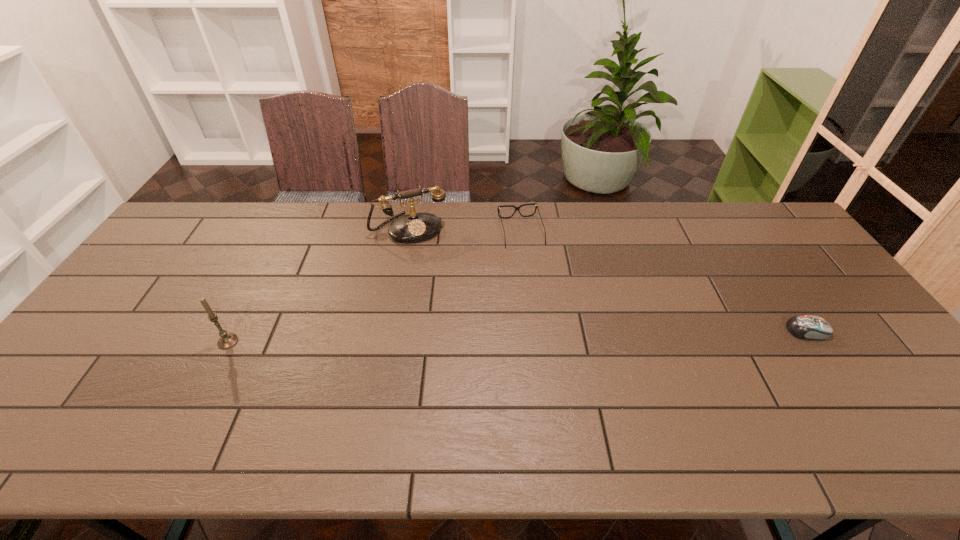
Identify the location of vacant space at the right edge of the desktop. The image size is (960, 540). (779, 259).

Identify the location of free spot at the far left corner of the desktop. (189, 220).

At what (x,y) coordinates should I click in order to perform the action: click on free location at the far right corner of the desktop. Please return your answer as a coordinate pair (x, y). Image resolution: width=960 pixels, height=540 pixels. Looking at the image, I should click on point(760,239).

Find the location of `blank region between the telephone and the second shortest object`. blank region between the telephone and the second shortest object is located at coordinates (466, 231).

This screenshot has width=960, height=540. Find the location of `vacant point located between the spectacles and the leftmost object`. vacant point located between the spectacles and the leftmost object is located at coordinates (374, 287).

The height and width of the screenshot is (540, 960). Find the location of `free spot between the leftmost object and the second shortest object`. free spot between the leftmost object and the second shortest object is located at coordinates (374, 287).

Where is `free spot between the computer mouse and the third object from right to left`? This screenshot has height=540, width=960. free spot between the computer mouse and the third object from right to left is located at coordinates (609, 280).

Locate an element on the screen. vacant region between the computer mouse and the candle is located at coordinates pyautogui.click(x=517, y=336).

Image resolution: width=960 pixels, height=540 pixels. In order to click on unoccupied position between the telephone and the leftmost object in this screenshot , I will do `click(319, 285)`.

I want to click on free space between the leftmost object and the shortest object, so click(517, 336).